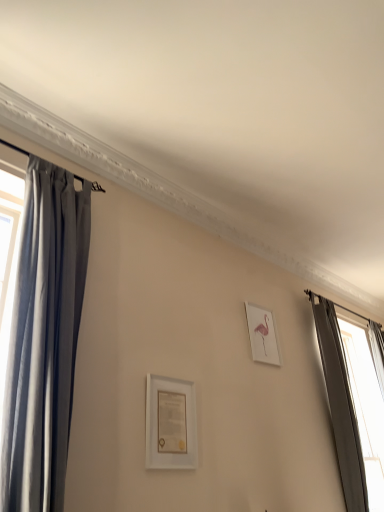
Question: Is white matte picture frame at center, placed as the second picture frame when sorted from right to left, in front of or behind dark gray fabric curtain at right, the second curtain viewed from the front, in the image?

Choices:
 (A) front
 (B) behind

Answer: (A)

Question: Is point (178, 440) positioned closer to the camera than point (362, 345)?

Choices:
 (A) farther
 (B) closer

Answer: (B)

Question: Considering the real-world distances, which object is farthest from the dark gray fabric curtain at right, the first curtain positioned from the back?

Choices:
 (A) pink paper at upper right, which is the second picture frame from front to back
 (B) white matte picture frame at center, which appears as the 1th picture frame when viewed from the left
 (C) silky gray curtain at left, the 1th curtain positioned from the left

Answer: (C)

Question: Estimate the real-world distances between objects in this image. Which object is closer to the white matte picture frame at center, which appears as the 1th picture frame when viewed from the left?

Choices:
 (A) silky gray curtain at left, the second curtain from the right
 (B) pink paper at upper right, which is the first picture frame in back-to-front order
 (C) dark gray fabric curtain at right, the second curtain viewed from the front

Answer: (A)